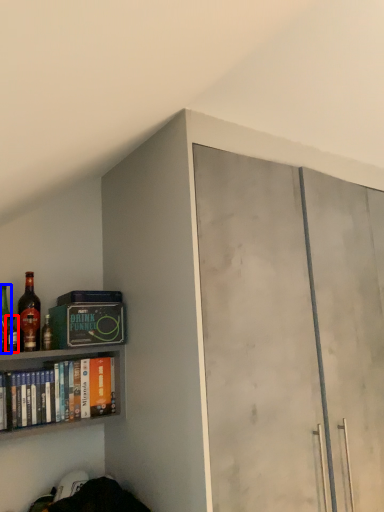
Question: Which object appears closest to the camera in this image, bottle (highlighted by a red box) or bottle (highlighted by a blue box)?

Choices:
 (A) bottle
 (B) bottle

Answer: (A)